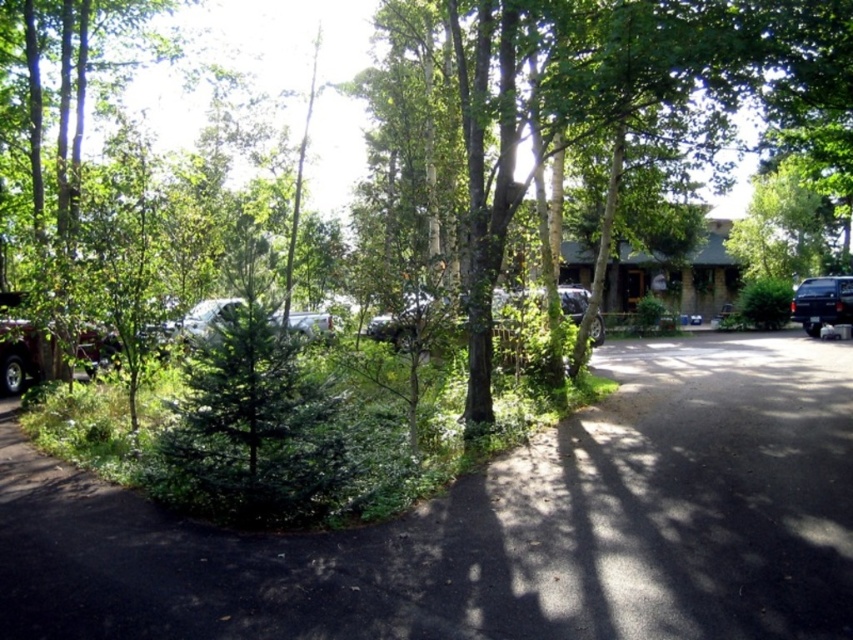
Is point (328, 316) farther from viewer compared to point (846, 301)?

No.

Who is more forward, (212, 317) or (820, 298)?

Point (212, 317)

At what (x,y) coordinates should I click in order to perform the action: click on metallic silver truck at center. Please return your answer as a coordinate pair (x, y). Looking at the image, I should click on (202, 317).

Can you confirm if dark asphalt driveway at lower center is bigger than black matte truck at right?

Correct, dark asphalt driveway at lower center is larger in size than black matte truck at right.

Which of these two, dark asphalt driveway at lower center or black matte truck at right, stands shorter?

black matte truck at right is shorter.

At what (x,y) coordinates should I click in order to perform the action: click on dark asphalt driveway at lower center. Please return your answer as a coordinate pair (x, y). The height and width of the screenshot is (640, 853). Looking at the image, I should click on (498, 525).

Does dark asphalt driveway at lower center appear under metallic silver truck at center?

Yes, dark asphalt driveway at lower center is below metallic silver truck at center.

Can you confirm if dark asphalt driveway at lower center is bigger than metallic silver truck at center?

Indeed, dark asphalt driveway at lower center has a larger size compared to metallic silver truck at center.

Is point (799, 412) in front of point (274, 316)?

No, it is behind (274, 316).

Where is `dark asphalt driveway at lower center`? The image size is (853, 640). dark asphalt driveway at lower center is located at coordinates (498, 525).